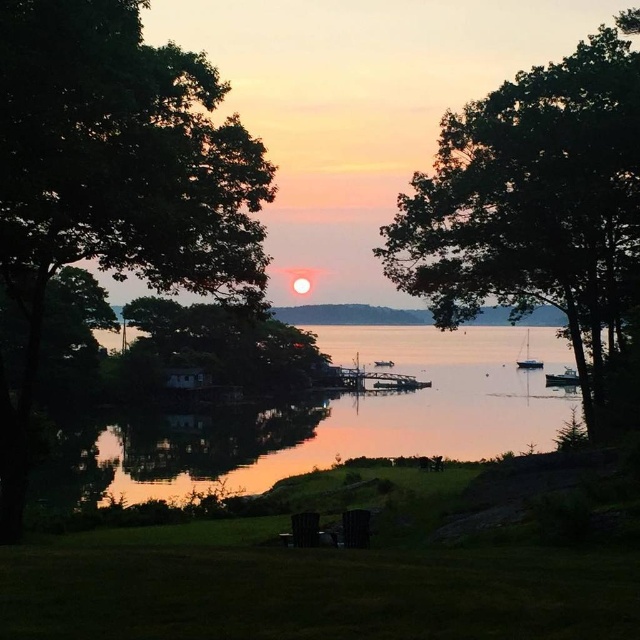
You are planning to set up a tent in this lakeside area. You want to ensure that the tent has a clear view of the sunset over the lake. Considering the green leafy tree at center and the metallic silver boat at center, which object might block the view if placed in front of the tent?

The green leafy tree at center is taller than the metallic silver boat at center, so the green leafy tree at center might block the view if placed in front of the tent.

You are a photographer planning to capture the sunset reflection on the water. You notice the green leafy tree at center and the glistening water at center. Which object is positioned higher in the scene?

The green leafy tree at center is located above the glistening water at center, so it is positioned higher in the scene.